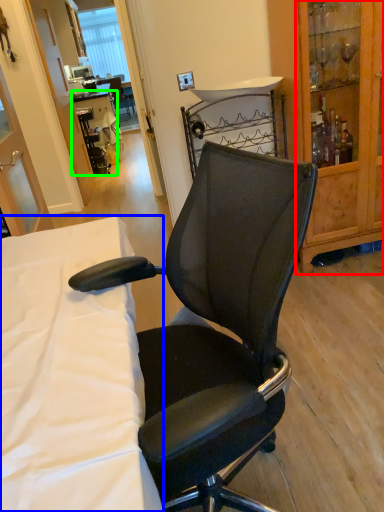
Question: Which is nearer to the cabinetry (highlighted by a red box)? desk (highlighted by a blue box) or table (highlighted by a green box).

Choices:
 (A) desk
 (B) table

Answer: (A)